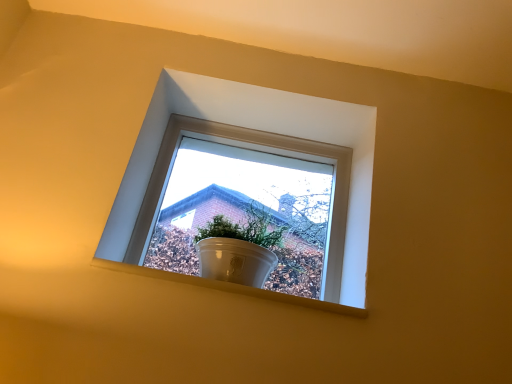
What do you see at coordinates (231, 288) in the screenshot? I see `white smooth window sill at center` at bounding box center [231, 288].

Locate an element on the screen. The width and height of the screenshot is (512, 384). white smooth window sill at center is located at coordinates (231, 288).

Image resolution: width=512 pixels, height=384 pixels. I want to click on white glossy pot at upper center, so click(x=261, y=129).

Where is `white glossy pot at center`? The width and height of the screenshot is (512, 384). white glossy pot at center is located at coordinates click(x=247, y=189).

From the image's perspective, is white glossy pot at upper center located above white glossy pot at center?

Indeed, from the image's perspective, white glossy pot at upper center is shown above white glossy pot at center.

Is white glossy pot at upper center in front of white glossy pot at center?

No.

Choose the correct answer: Is white glossy pot at upper center inside white glossy pot at center or outside it?

white glossy pot at upper center cannot be found inside white glossy pot at center.

Does white glossy pot at upper center have a greater height compared to white glossy pot at center?

Yes, white glossy pot at upper center is taller than white glossy pot at center.

Are white glossy pot at center and white smooth window sill at center beside each other?

white glossy pot at center is not next to white smooth window sill at center, and they're not touching.

In terms of width, does white glossy pot at center look wider or thinner when compared to white smooth window sill at center?

white glossy pot at center is wider than white smooth window sill at center.

How much distance is there between white glossy pot at center and white smooth window sill at center?

white glossy pot at center is 21.34 inches away from white smooth window sill at center.

From a real-world perspective, does white glossy pot at center stand above white smooth window sill at center?

Yes, from a real-world perspective, white glossy pot at center is above white smooth window sill at center.

From the image's perspective, is white glossy pot at upper center above white smooth window sill at center?

Yes, from the image's perspective, white glossy pot at upper center is above white smooth window sill at center.

Between white glossy pot at upper center and white smooth window sill at center, which one has smaller size?

white smooth window sill at center is smaller.

Consider the image. Is white glossy pot at upper center outside of white smooth window sill at center?

white glossy pot at upper center lies outside white smooth window sill at center's area.

Between white glossy pot at upper center and white smooth window sill at center, which one has larger width?

white smooth window sill at center is wider.

From a real-world perspective, is white smooth window sill at center positioned under white glossy pot at center based on gravity?

Indeed, from a real-world perspective, white smooth window sill at center is positioned beneath white glossy pot at center.

Would you say white smooth window sill at center is to the left or to the right of white glossy pot at center in the picture?

In the image, white smooth window sill at center appears on the left side of white glossy pot at center.

How distant is white smooth window sill at center from white glossy pot at center?

white smooth window sill at center and white glossy pot at center are 21.34 inches apart from each other.

Between point (283, 302) and point (240, 204), which one is positioned behind?

Point (240, 204)

Does white smooth window sill at center have a lesser width compared to white glossy pot at upper center?

Incorrect, the width of white smooth window sill at center is not less than that of white glossy pot at upper center.

Based on their positions, is white smooth window sill at center located to the left or right of white glossy pot at upper center?

Clearly, white smooth window sill at center is on the left of white glossy pot at upper center in the image.

I want to click on window sill below the white glossy pot at upper center (from a real-world perspective), so click(231, 288).

Is white glossy pot at center wider than white glossy pot at upper center?

Yes, white glossy pot at center is wider than white glossy pot at upper center.

Considering the relative sizes of white glossy pot at center and white glossy pot at upper center in the image provided, is white glossy pot at center shorter than white glossy pot at upper center?

Yes, white glossy pot at center is shorter than white glossy pot at upper center.

Is white glossy pot at center oriented away from white glossy pot at upper center?

Yes, white glossy pot at upper center is at the back of white glossy pot at center.

Between white glossy pot at center and white glossy pot at upper center, which one appears on the left side from the viewer's perspective?

Positioned to the left is white glossy pot at upper center.

Find the location of a particular element. This screenshot has width=512, height=384. window behind the white glossy pot at center is located at coordinates (261, 129).

Identify the location of morning light in front of the white smooth window sill at center. (247, 189).

Consider the image. From the image, which object appears to be farther from white glossy pot at center, white glossy pot at upper center or white smooth window sill at center?

The object further to white glossy pot at center is white smooth window sill at center.

Consider the image. Considering their positions, is white smooth window sill at center positioned closer to white glossy pot at center than white glossy pot at upper center?

Among the two, white glossy pot at upper center is located nearer to white glossy pot at center.

Estimate the real-world distances between objects in this image. Which object is further from white glossy pot at upper center, white smooth window sill at center or white glossy pot at center?

white smooth window sill at center lies further to white glossy pot at upper center than the other object.

Which object lies further to the anchor point white smooth window sill at center, white glossy pot at center or white glossy pot at upper center?

Result: white glossy pot at center.

Based on their spatial positions, is white glossy pot at center or white smooth window sill at center closer to white glossy pot at upper center?

white glossy pot at center is closer to white glossy pot at upper center.

Considering their positions, is white glossy pot at upper center positioned further to white smooth window sill at center than white glossy pot at center?

Among the two, white glossy pot at center is located further to white smooth window sill at center.

In order to click on window sill between white glossy pot at center and white glossy pot at upper center in the front-back direction in this screenshot , I will do `click(231, 288)`.